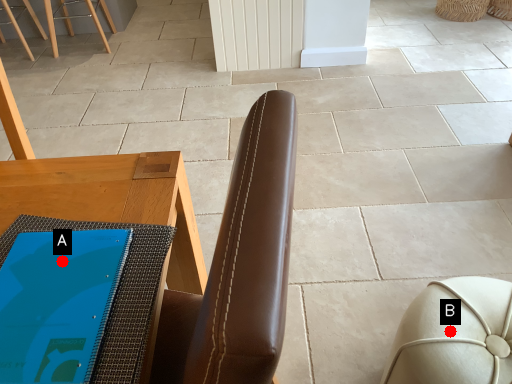
Question: Two points are circled on the image, labeled by A and B beside each circle. Which point is farther from the camera taking this photo?

Choices:
 (A) A is further
 (B) B is further

Answer: (B)